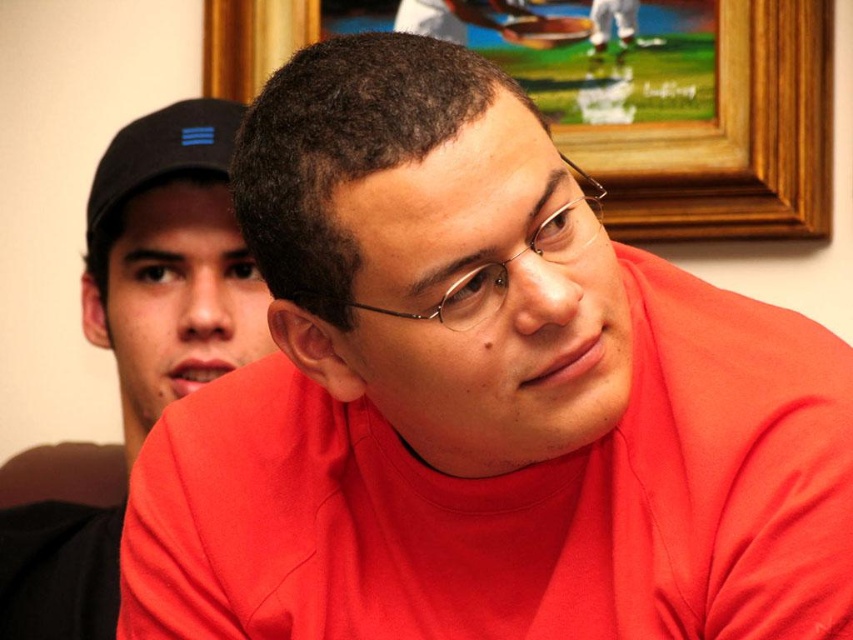
You are arranging a photo album and need to place the wooden picture frame at upper center and the black matte baseball cap at upper left in a row. Based on their positions in the image, which object should be placed to the left in the album?

The black matte baseball cap at upper left should be placed to the left in the album since the wooden picture frame at upper center is positioned on the right side of it in the image.

You are standing in the room and notice the matte black cap at upper left and the metallic wireframe glasses at center. Which object is positioned more to the left side of the room?

The matte black cap at upper left is positioned more to the left side of the room than the metallic wireframe glasses at center.